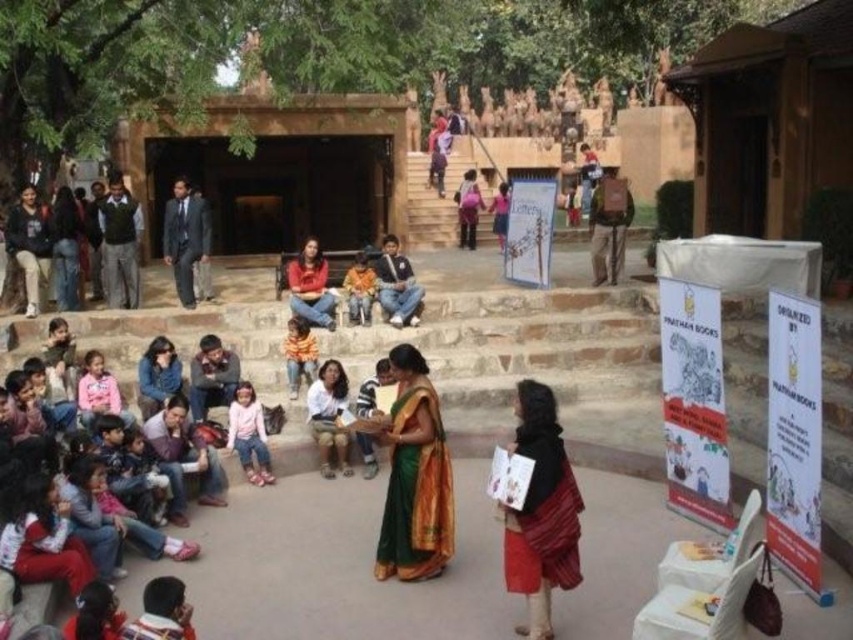
Between white cotton shirt at center and pink fabric pants at lower center, which one is positioned lower?

pink fabric pants at lower center is lower down.

Is point (337, 440) positioned before point (262, 468)?

No.

Where is `white cotton shirt at center`? Image resolution: width=853 pixels, height=640 pixels. white cotton shirt at center is located at coordinates (329, 417).

Can you confirm if red silk sari at lower right is bigger than orange cotton sweater at center?

Answer: Yes, red silk sari at lower right is bigger than orange cotton sweater at center.

The image size is (853, 640). Identify the location of red silk sari at lower right. (541, 513).

From the picture: Does green silk saree at center appear on the left side of pink fabric pants at lower center?

In fact, green silk saree at center is to the right of pink fabric pants at lower center.

Does point (393, 426) come closer to viewer compared to point (245, 413)?

Yes, point (393, 426) is in front of point (245, 413).

Is point (393, 403) positioned after point (233, 428)?

No.

Locate an element on the screen. green silk saree at center is located at coordinates tap(415, 476).